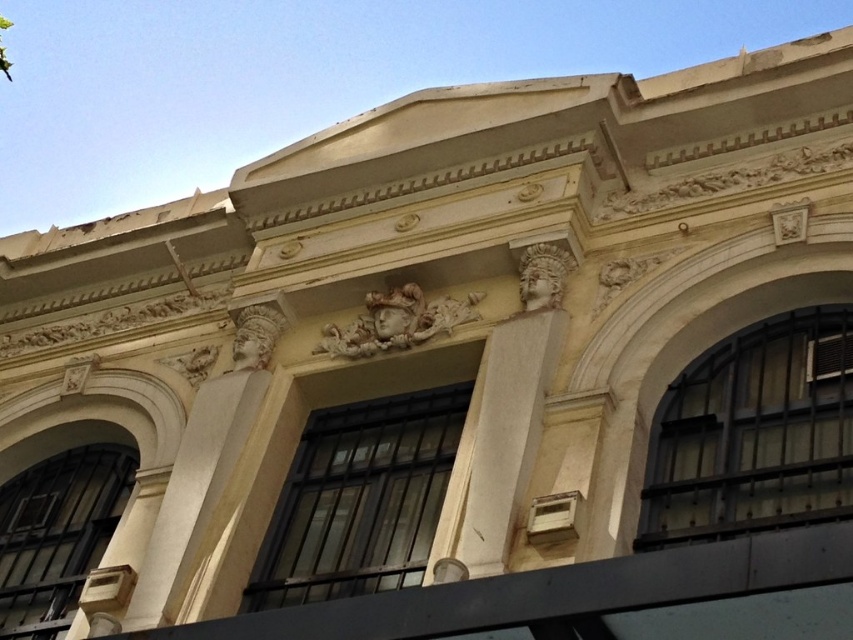
Question: Does white stone column at center have a greater width compared to white marble column at center?

Choices:
 (A) no
 (B) yes

Answer: (B)

Question: Is white stone column at center wider than white marble column at center?

Choices:
 (A) no
 (B) yes

Answer: (B)

Question: Which of the following is the closest to the observer?

Choices:
 (A) white stone column at center
 (B) white marble column at center

Answer: (A)

Question: Among these points, which one is nearest to the camera?

Choices:
 (A) (491, 486)
 (B) (184, 461)

Answer: (A)

Question: Is white stone column at center below white marble column at center?

Choices:
 (A) yes
 (B) no

Answer: (B)

Question: Among these objects, which one is farthest from the camera?

Choices:
 (A) white marble column at center
 (B) white stone column at center

Answer: (A)